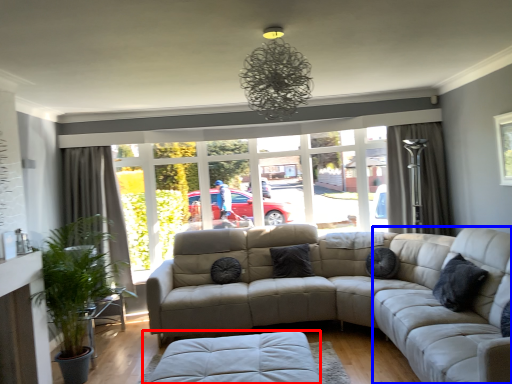
Question: Which object is further to the camera taking this photo, footrest (highlighted by a red box) or couch (highlighted by a blue box)?

Choices:
 (A) footrest
 (B) couch

Answer: (A)